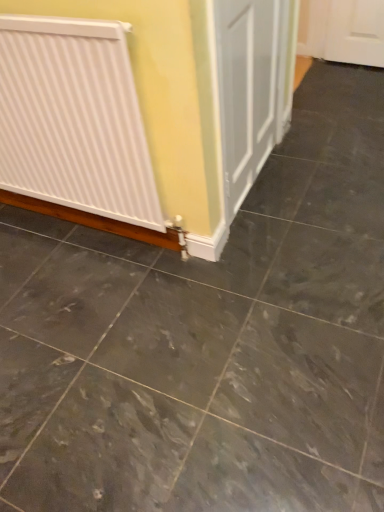
Question: Considering the relative sizes of gray marble floor at center and white ribbed radiator at left in the image provided, is gray marble floor at center taller than white ribbed radiator at left?

Choices:
 (A) yes
 (B) no

Answer: (B)

Question: Is gray marble floor at center beside white ribbed radiator at left?

Choices:
 (A) yes
 (B) no

Answer: (B)

Question: Does gray marble floor at center appear on the left side of white ribbed radiator at left?

Choices:
 (A) yes
 (B) no

Answer: (B)

Question: Can you confirm if gray marble floor at center is wider than white ribbed radiator at left?

Choices:
 (A) no
 (B) yes

Answer: (B)

Question: Is gray marble floor at center in front of white ribbed radiator at left?

Choices:
 (A) yes
 (B) no

Answer: (A)

Question: From a real-world perspective, does gray marble floor at center stand above white ribbed radiator at left?

Choices:
 (A) no
 (B) yes

Answer: (A)

Question: Does white ribbed radiator at left appear on the right side of gray marble floor at center?

Choices:
 (A) no
 (B) yes

Answer: (A)

Question: Does white ribbed radiator at left have a smaller size compared to gray marble floor at center?

Choices:
 (A) yes
 (B) no

Answer: (B)

Question: Does white ribbed radiator at left contain gray marble floor at center?

Choices:
 (A) yes
 (B) no

Answer: (B)

Question: Can you confirm if white ribbed radiator at left is taller than gray marble floor at center?

Choices:
 (A) no
 (B) yes

Answer: (B)

Question: Is white ribbed radiator at left facing away from gray marble floor at center?

Choices:
 (A) no
 (B) yes

Answer: (A)

Question: From a real-world perspective, is white ribbed radiator at left located beneath gray marble floor at center?

Choices:
 (A) yes
 (B) no

Answer: (B)

Question: Is gray marble floor at center in front of or behind white ribbed radiator at left in the image?

Choices:
 (A) behind
 (B) front

Answer: (B)